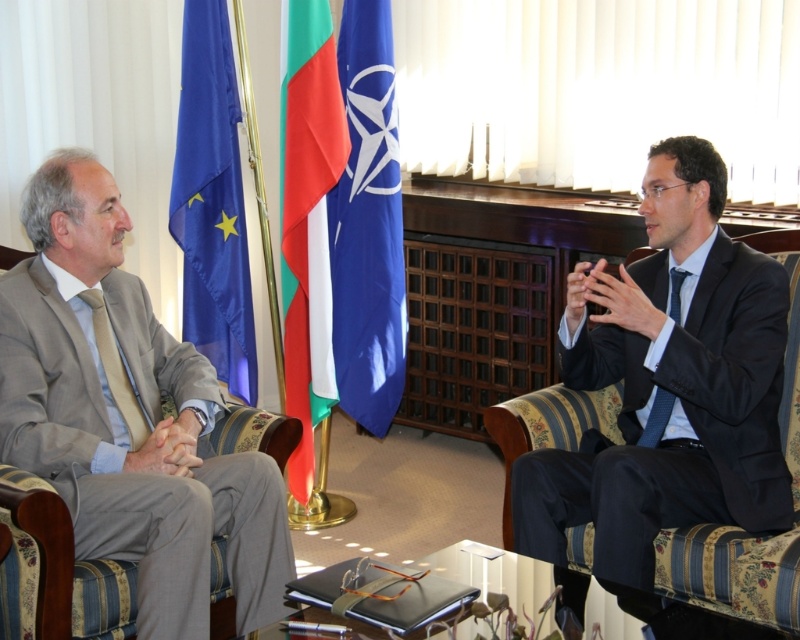
Question: Does blue fabric flag at left appear on the right side of beige fabric tie at left?

Choices:
 (A) yes
 (B) no

Answer: (A)

Question: Which point appears closest to the camera in this image?

Choices:
 (A) (96, 323)
 (B) (182, 156)
 (C) (96, 252)

Answer: (C)

Question: Which of the following is the closest to the observer?

Choices:
 (A) beige fabric tie at left
 (B) blue fabric flag at center
 (C) dark blue suit at right

Answer: (C)

Question: Which of the following is the closest to the observer?

Choices:
 (A) dark blue suit at right
 (B) blue fabric flag at center
 (C) light beige suit at left

Answer: (A)

Question: Does light beige suit at left appear on the left side of blue fabric flag at center?

Choices:
 (A) no
 (B) yes

Answer: (B)

Question: Does dark blue suit at right have a greater width compared to blue silk tie at right?

Choices:
 (A) yes
 (B) no

Answer: (A)